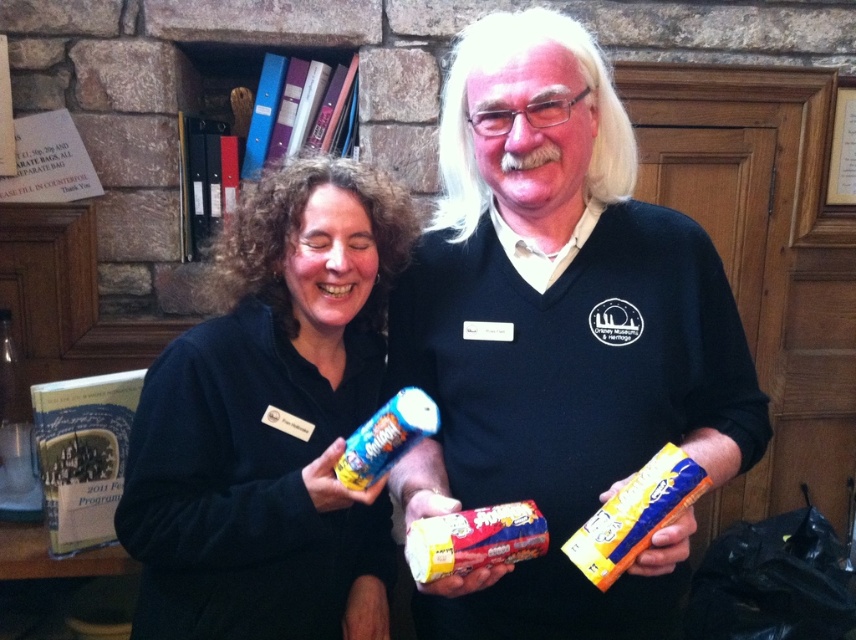
Question: Which of the following is the farthest from the observer?

Choices:
 (A) (428, 417)
 (B) (437, 552)
 (C) (498, 413)

Answer: (C)

Question: Can you confirm if matte plastic snack at center is wider than blue shiny can at center?

Choices:
 (A) no
 (B) yes

Answer: (B)

Question: Can you confirm if yellow paper snack at center is wider than blue shiny can at center?

Choices:
 (A) yes
 (B) no

Answer: (A)

Question: Which of the following is the farthest from the observer?

Choices:
 (A) matte black sweater at center
 (B) matte plastic snack at center
 (C) yellow paper snack at center

Answer: (A)

Question: Which of these objects is positioned closest to the black matte can at center?

Choices:
 (A) yellow paper snack at center
 (B) blue shiny can at center
 (C) matte plastic snack at center

Answer: (B)

Question: Does matte black sweater at center appear over black matte can at center?

Choices:
 (A) no
 (B) yes

Answer: (B)